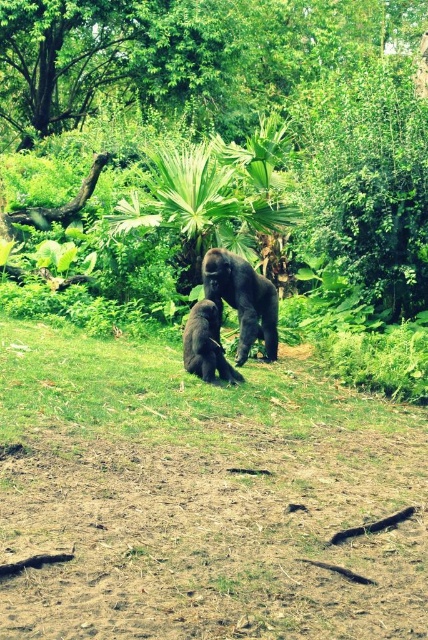
You are a zookeeper observing the two gorillas in their enclosure. You notice two specific points in the habitat marked as point 1 at coordinate (400, 566) and point 2 at coordinate (217, 371). Which of these points is nearer to your viewpoint as you look at the enclosure?

Point 1 at coordinate (400, 566) is closer to the camera than point 2 at coordinate (217, 371).

You are a zookeeper planning to place a new feeding station in the gorilla habitat. The feeding station must be placed at least 2 meters away from the brown soil at center to avoid contamination. Given that the coordinate system starts at the bottom left corner of the image, with x increasing to the right and y increasing upward, can you determine if the feeding station at position point 0.650, 0.350 is placed correctly?

The brown soil at center is located at point (x=202, y=499). The feeding station at point (x=149, y=416) is closer than 2 meters, so it is not placed correctly.

You are a zookeeper observing the gorillas in their habitat. You notice the brown soil at center and the shiny black gorilla at center. Which object is closer to you, the observer?

The brown soil at center is closer to you because it is positioned in front of the shiny black gorilla at center.